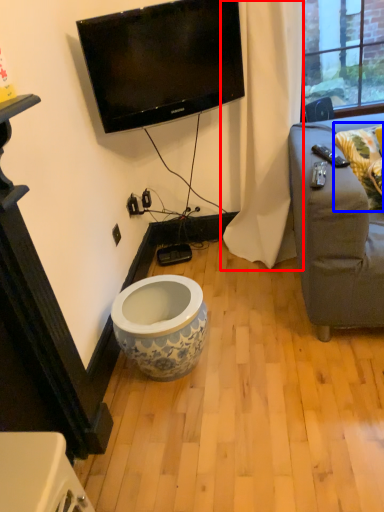
Question: Which object is further to the camera taking this photo, curtain (highlighted by a red box) or pillow (highlighted by a blue box)?

Choices:
 (A) curtain
 (B) pillow

Answer: (B)